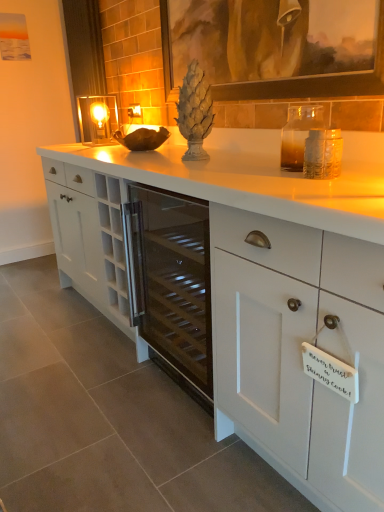
This screenshot has height=512, width=384. Describe the element at coordinates (314, 81) in the screenshot. I see `matte brown picture frame at upper center` at that location.

Locate an element on the screen. This screenshot has height=512, width=384. white matte cabinet at center is located at coordinates (299, 353).

Identify the location of matte brown picture frame at upper center. Image resolution: width=384 pixels, height=512 pixels. (314, 81).

Would you say matte brown picture frame at upper center is a long distance from white matte cabinet at center?

matte brown picture frame at upper center is actually quite close to white matte cabinet at center.

From the image's perspective, which is above, matte brown picture frame at upper center or white matte cabinet at center?

matte brown picture frame at upper center is shown above in the image.

Could white matte cabinet at center be considered to be inside matte brown picture frame at upper center?

That's incorrect, white matte cabinet at center is not inside matte brown picture frame at upper center.

From a real-world perspective, which is physically above, matte brown picture frame at upper center or white matte cabinet at center?

matte brown picture frame at upper center is physically above.

Are white matte cabinet at center and matte brown picture frame at upper center beside each other?

There is a gap between white matte cabinet at center and matte brown picture frame at upper center.

How much distance is there between white matte cabinet at center and matte brown picture frame at upper center?

white matte cabinet at center and matte brown picture frame at upper center are 35.21 inches apart.

Considering the positions of objects white matte cabinet at center and matte brown picture frame at upper center in the image provided, who is in front, white matte cabinet at center or matte brown picture frame at upper center?

white matte cabinet at center.

Is white matte cabinet at center turned away from matte brown picture frame at upper center?

No.

Does matte brown picture frame at upper center turn towards matte glass candle holder at upper left?

No, matte brown picture frame at upper center is not aimed at matte glass candle holder at upper left.

Considering the points (291, 88) and (89, 116), which point is in front, point (291, 88) or point (89, 116)?

Positioned in front is point (291, 88).

Based on their positions, is matte brown picture frame at upper center located to the left or right of matte glass candle holder at upper left?

From the image, it's evident that matte brown picture frame at upper center is to the right of matte glass candle holder at upper left.

Who is taller, matte brown picture frame at upper center or matte glass candle holder at upper left?

matte brown picture frame at upper center.

At what (x,y) coordinates should I click in order to perform the action: click on picture frame below the matte glass electric outlet at center (from the image's perspective). Please return your answer as a coordinate pair (x, y). Looking at the image, I should click on (314, 81).

Is the depth of matte brown picture frame at upper center less than that of matte glass electric outlet at center?

Yes, matte brown picture frame at upper center is closer to the viewer.

Is matte brown picture frame at upper center to the left of matte glass electric outlet at center from the viewer's perspective?

In fact, matte brown picture frame at upper center is to the right of matte glass electric outlet at center.

Consider the image. Is matte glass electric outlet at center wider than white matte cabinet at center?

In fact, matte glass electric outlet at center might be narrower than white matte cabinet at center.

Identify the location of electric outlet that is on the left side of white matte cabinet at center. The image size is (384, 512). (135, 110).

Which is correct: matte glass electric outlet at center is inside white matte cabinet at center, or outside of it?

matte glass electric outlet at center is not enclosed by white matte cabinet at center.

From a real-world perspective, between matte glass electric outlet at center and white matte cabinet at center, who is vertically higher?

matte glass electric outlet at center.

Is matte glass candle holder at upper left in front of or behind white matte cabinet at center in the image?

matte glass candle holder at upper left is behind white matte cabinet at center.

Is matte glass candle holder at upper left inside or outside of white matte cabinet at center?

The correct answer is: outside.

Does matte glass candle holder at upper left appear on the left side of white matte cabinet at center?

Indeed, matte glass candle holder at upper left is positioned on the left side of white matte cabinet at center.

How much distance is there between matte glass candle holder at upper left and white matte cabinet at center?

matte glass candle holder at upper left and white matte cabinet at center are 5.48 feet apart from each other.

Locate an element on the screen. cabinetry below the matte glass electric outlet at center (from a real-world perspective) is located at coordinates (299, 353).

Would you consider white matte cabinet at center to be distant from matte glass electric outlet at center?

Yes.

Who is taller, white matte cabinet at center or matte glass electric outlet at center?

white matte cabinet at center is taller.

Between white matte cabinet at center and matte glass electric outlet at center, which one is positioned behind?

matte glass electric outlet at center is more distant.

Find the location of a particular element. The height and width of the screenshot is (512, 384). cabinetry lying on the right of matte brown picture frame at upper center is located at coordinates (299, 353).

Where is `picture frame on the left of white matte cabinet at center`? The image size is (384, 512). picture frame on the left of white matte cabinet at center is located at coordinates (314, 81).

When comparing their distances from matte brown picture frame at upper center, does white matte cabinet at center or matte glass electric outlet at center seem further?

matte glass electric outlet at center is positioned further to the anchor matte brown picture frame at upper center.

Based on their spatial positions, is white matte cabinet at center or matte glass candle holder at upper left closer to matte glass electric outlet at center?

matte glass candle holder at upper left.

Based on their spatial positions, is matte glass electric outlet at center or matte glass candle holder at upper left closer to matte brown picture frame at upper center?

The object closer to matte brown picture frame at upper center is matte glass candle holder at upper left.

Considering their positions, is matte glass candle holder at upper left positioned closer to white matte cabinet at center than matte brown picture frame at upper center?

matte brown picture frame at upper center lies closer to white matte cabinet at center than the other object.

Which object lies further to the anchor point white matte cabinet at center, matte glass electric outlet at center or matte glass candle holder at upper left?

Based on the image, matte glass electric outlet at center appears to be further to white matte cabinet at center.

Based on their spatial positions, is white matte cabinet at center or matte glass candle holder at upper left closer to matte brown picture frame at upper center?

Among the two, white matte cabinet at center is located nearer to matte brown picture frame at upper center.

Based on their spatial positions, is matte glass electric outlet at center or matte brown picture frame at upper center further from white matte cabinet at center?

Among the two, matte glass electric outlet at center is located further to white matte cabinet at center.

When comparing their distances from matte brown picture frame at upper center, does matte glass candle holder at upper left or matte glass electric outlet at center seem closer?

matte glass candle holder at upper left lies closer to matte brown picture frame at upper center than the other object.

Where is `picture frame between white matte cabinet at center and matte glass candle holder at upper left along the z-axis`? picture frame between white matte cabinet at center and matte glass candle holder at upper left along the z-axis is located at coordinates (314, 81).

This screenshot has height=512, width=384. Find the location of `candle holder between matte brown picture frame at upper center and matte glass electric outlet at center in the front-back direction`. candle holder between matte brown picture frame at upper center and matte glass electric outlet at center in the front-back direction is located at coordinates (97, 118).

Identify the location of candle holder positioned between white matte cabinet at center and matte glass electric outlet at center from near to far. This screenshot has height=512, width=384. (97, 118).

Find the location of `picture frame between white matte cabinet at center and matte glass electric outlet at center along the z-axis`. picture frame between white matte cabinet at center and matte glass electric outlet at center along the z-axis is located at coordinates (314, 81).